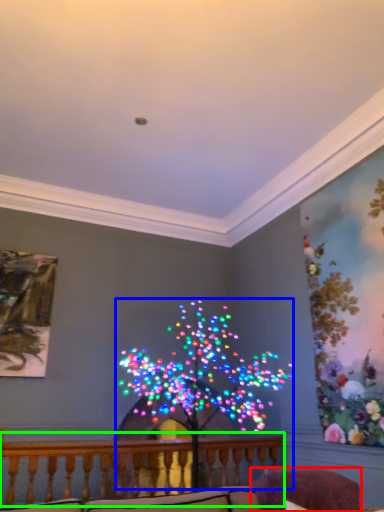
Question: Based on their relative distances, which object is nearer to swivel chair (highlighted by a red box)? Choose from christmas decoration (highlighted by a blue box) and balcony (highlighted by a green box).

Choices:
 (A) christmas decoration
 (B) balcony

Answer: (A)